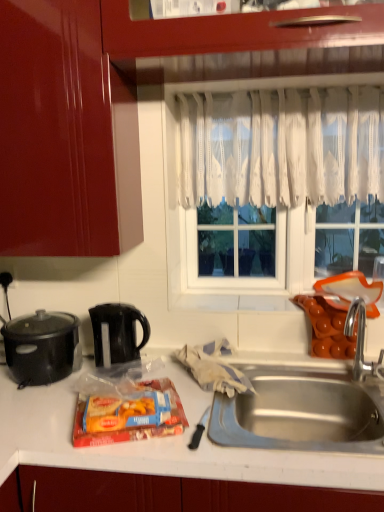
Question: Is black matte slow cooker at left, the second kitchen appliance in the right-to-left sequence, bigger than black plastic kettle at center-left, which is counted as the second kitchen appliance, starting from the left?

Choices:
 (A) yes
 (B) no

Answer: (A)

Question: Is black matte slow cooker at left, the second kitchen appliance in the right-to-left sequence, thinner than black plastic kettle at center-left, which is counted as the second kitchen appliance, starting from the left?

Choices:
 (A) yes
 (B) no

Answer: (B)

Question: Considering the relative positions of black matte slow cooker at left, which is the first kitchen appliance in left-to-right order, and black plastic kettle at center-left, which is the first kitchen appliance from right to left, in the image provided, is black matte slow cooker at left, which is the first kitchen appliance in left-to-right order, behind black plastic kettle at center-left, which is the first kitchen appliance from right to left,?

Choices:
 (A) no
 (B) yes

Answer: (A)

Question: From the image's perspective, is black matte slow cooker at left, the second kitchen appliance in the right-to-left sequence, above black plastic kettle at center-left, which is the first kitchen appliance from right to left?

Choices:
 (A) yes
 (B) no

Answer: (B)

Question: Considering the relative sizes of black matte slow cooker at left, the second kitchen appliance in the right-to-left sequence, and black plastic kettle at center-left, which is the first kitchen appliance from right to left, in the image provided, is black matte slow cooker at left, the second kitchen appliance in the right-to-left sequence, wider than black plastic kettle at center-left, which is the first kitchen appliance from right to left,?

Choices:
 (A) no
 (B) yes

Answer: (B)

Question: From a real-world perspective, is black matte slow cooker at left, the second kitchen appliance in the right-to-left sequence, physically below black plastic kettle at center-left, which is counted as the second kitchen appliance, starting from the left?

Choices:
 (A) yes
 (B) no

Answer: (B)

Question: Is matte plastic snack pack at center facing towards white lace curtain at upper center?

Choices:
 (A) yes
 (B) no

Answer: (B)

Question: Is matte plastic snack pack at center positioned beyond the bounds of white lace curtain at upper center?

Choices:
 (A) yes
 (B) no

Answer: (A)

Question: From a real-world perspective, is matte plastic snack pack at center on white lace curtain at upper center?

Choices:
 (A) no
 (B) yes

Answer: (A)

Question: Can you confirm if matte plastic snack pack at center is thinner than white lace curtain at upper center?

Choices:
 (A) yes
 (B) no

Answer: (B)

Question: Would you consider matte plastic snack pack at center to be distant from white lace curtain at upper center?

Choices:
 (A) no
 (B) yes

Answer: (A)

Question: From the image's perspective, would you say matte plastic snack pack at center is positioned over white lace curtain at upper center?

Choices:
 (A) no
 (B) yes

Answer: (A)

Question: Is matte plastic snack pack at center thinner than black plastic kettle at center-left, which is counted as the second kitchen appliance, starting from the left?

Choices:
 (A) yes
 (B) no

Answer: (B)